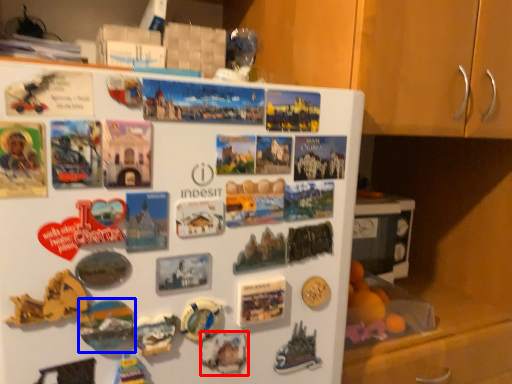
Question: Which point is further to the camera, art (highlighted by a red box) or art (highlighted by a blue box)?

Choices:
 (A) art
 (B) art

Answer: (A)